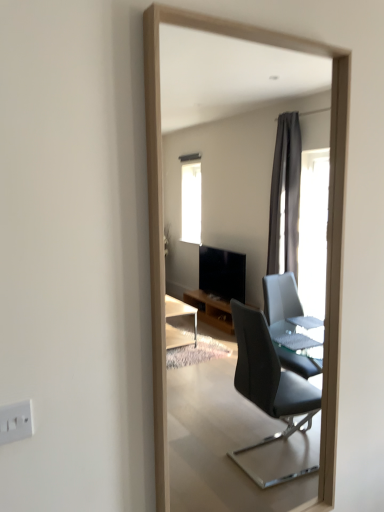
The image size is (384, 512). What are the coordinates of `wooden frame at center` in the screenshot? It's located at (231, 140).

Describe the element at coordinates (231, 140) in the screenshot. I see `wooden frame at center` at that location.

Describe the element at coordinates (16, 422) in the screenshot. This screenshot has width=384, height=512. I see `white plastic electric outlet at lower left` at that location.

At what (x,y) coordinates should I click in order to perform the action: click on white plastic electric outlet at lower left. Please return your answer as a coordinate pair (x, y). Looking at the image, I should click on (16, 422).

The width and height of the screenshot is (384, 512). Identify the location of wooden frame at center. (231, 140).

Does wooden frame at center appear on the left side of white plastic electric outlet at lower left?

No.

Is the depth of wooden frame at center greater than that of white plastic electric outlet at lower left?

That is True.

Which point is more forward, (209, 170) or (26, 407)?

The point (26, 407) is closer.

From the image's perspective, between wooden frame at center and white plastic electric outlet at lower left, who is located below?

white plastic electric outlet at lower left.

From a real-world perspective, does wooden frame at center stand above white plastic electric outlet at lower left?

Correct, in the physical world, wooden frame at center is higher than white plastic electric outlet at lower left.

Does wooden frame at center have a lesser width compared to white plastic electric outlet at lower left?

In fact, wooden frame at center might be wider than white plastic electric outlet at lower left.

From the picture: Is wooden frame at center taller or shorter than white plastic electric outlet at lower left?

wooden frame at center is taller than white plastic electric outlet at lower left.

Considering the relative sizes of wooden frame at center and white plastic electric outlet at lower left in the image provided, is wooden frame at center bigger than white plastic electric outlet at lower left?

Yes.

Is wooden frame at center not within white plastic electric outlet at lower left?

Indeed, wooden frame at center is completely outside white plastic electric outlet at lower left.

Is wooden frame at center not close to white plastic electric outlet at lower left?

Yes, wooden frame at center and white plastic electric outlet at lower left are located far from each other.

Is wooden frame at center looking in the opposite direction of white plastic electric outlet at lower left?

No, wooden frame at center's orientation is not away from white plastic electric outlet at lower left.

Can you tell me how much wooden frame at center and white plastic electric outlet at lower left differ in facing direction?

0.192 degrees.

Measure the distance from wooden frame at center to white plastic electric outlet at lower left.

14.58 feet.

Locate an element on the screen. This screenshot has width=384, height=512. electric outlet on the left of wooden frame at center is located at coordinates (16, 422).

Is white plastic electric outlet at lower left to the right of wooden frame at center from the viewer's perspective?

No, white plastic electric outlet at lower left is not to the right of wooden frame at center.

Relative to wooden frame at center, is white plastic electric outlet at lower left in front or behind?

In the image, white plastic electric outlet at lower left appears in front of wooden frame at center.

Does point (4, 433) come behind point (191, 216)?

No, it is not.

Looking at this image, from the image's perspective, which is above, white plastic electric outlet at lower left or wooden frame at center?

wooden frame at center appears higher in the image.

From a real-world perspective, is white plastic electric outlet at lower left physically above wooden frame at center?

No.

From the picture: Between white plastic electric outlet at lower left and wooden frame at center, which one has smaller width?

Thinner between the two is white plastic electric outlet at lower left.

Between white plastic electric outlet at lower left and wooden frame at center, which one has less height?

With less height is white plastic electric outlet at lower left.

Between white plastic electric outlet at lower left and wooden frame at center, which one has smaller size?

white plastic electric outlet at lower left is smaller.

Is white plastic electric outlet at lower left spatially inside wooden frame at center, or outside of it?

white plastic electric outlet at lower left is located beyond the bounds of wooden frame at center.

Are white plastic electric outlet at lower left and wooden frame at center far apart?

Yes.

Is white plastic electric outlet at lower left oriented away from wooden frame at center?

No, wooden frame at center is not at the back of white plastic electric outlet at lower left.

How distant is white plastic electric outlet at lower left from wooden frame at center?

4.44 meters.

Where is `mirror that appears on the right of white plastic electric outlet at lower left`? The width and height of the screenshot is (384, 512). mirror that appears on the right of white plastic electric outlet at lower left is located at coordinates tap(231, 140).

In the image, there is a wooden frame at center. Identify the location of electric outlet below it (from the image's perspective). The height and width of the screenshot is (512, 384). (16, 422).

Locate an element on the screen. electric outlet below the wooden frame at center (from a real-world perspective) is located at coordinates (16, 422).